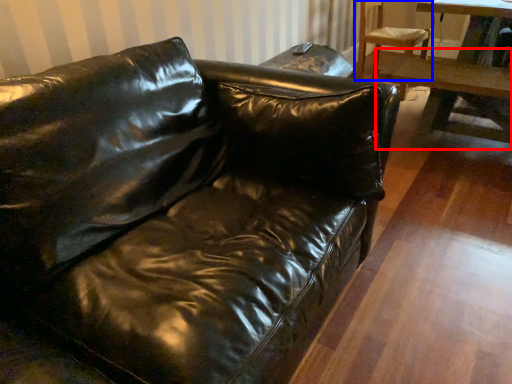
Question: Among these objects, which one is nearest to the camera, table (highlighted by a red box) or chair (highlighted by a blue box)?

Choices:
 (A) table
 (B) chair

Answer: (A)